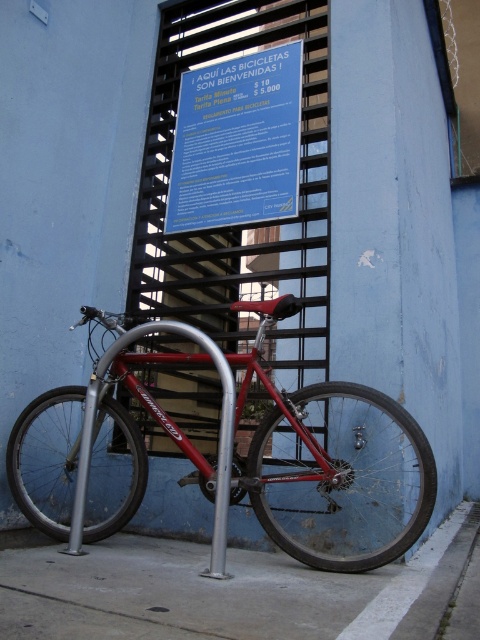
You are a delivery person who needs to access the staircase behind the shiny red bicycle at center and the silver metallic pole at center. Can you walk through the space between them?

The shiny red bicycle at center is in front of the silver metallic pole at center, so there is no space between them for you to walk through.

You are standing at the entrance of a building and see the gray concrete pavement at lower center and the silver metallic pole at center. Which object is nearer to you?

The gray concrete pavement at lower center is closer to the viewer than the silver metallic pole at center.